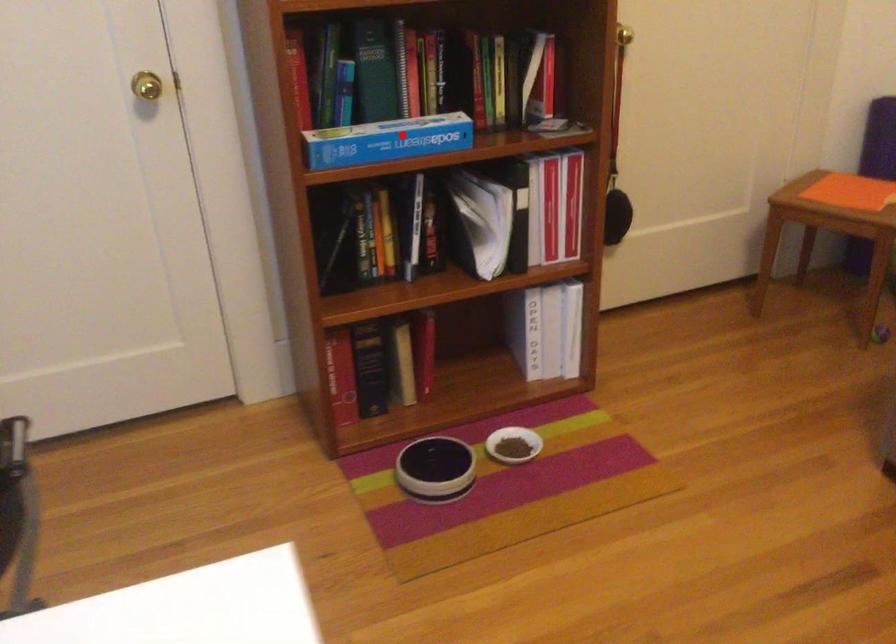
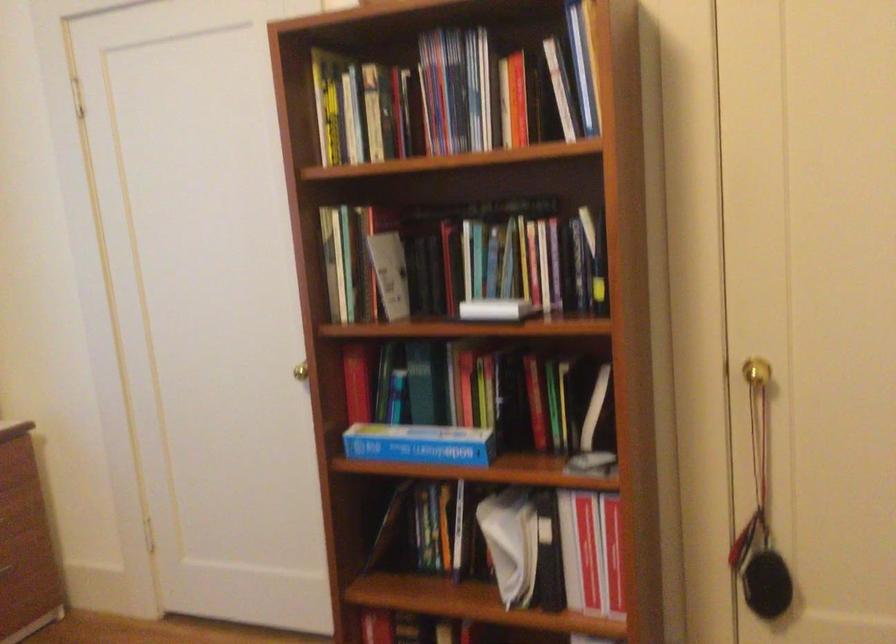
Where in the second image is the point corresponding to the highlighted location from the first image?

(419, 444)